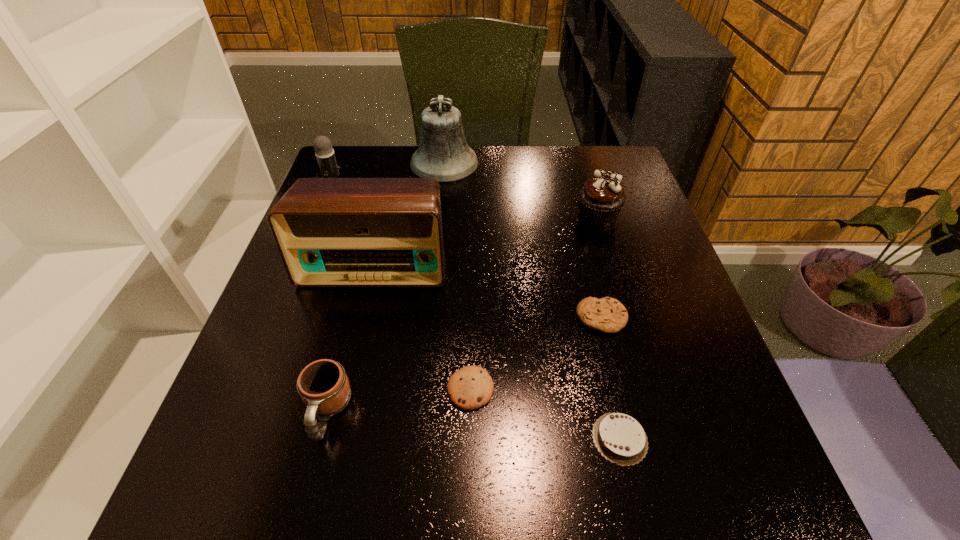
Identify the location of bell. (444, 154).

Find the location of a particular element. This screenshot has width=960, height=540. the fifth nearest object is located at coordinates (330, 232).

At what (x,y) coordinates should I click in order to perform the action: click on the seventh nearest object. Please return your answer as a coordinate pair (x, y). This screenshot has width=960, height=540. Looking at the image, I should click on (325, 155).

At what (x,y) coordinates should I click in order to perform the action: click on microphone. Please return your answer as a coordinate pair (x, y). This screenshot has height=540, width=960. Looking at the image, I should click on (325, 155).

Identify the location of cupcake. The height and width of the screenshot is (540, 960). (601, 198).

Where is `the third farthest object`? This screenshot has height=540, width=960. the third farthest object is located at coordinates [601, 198].

Locate an element on the screen. the fifth tallest object is located at coordinates (323, 385).

Find the location of `the fourth nearest object`. the fourth nearest object is located at coordinates (608, 315).

The image size is (960, 540). What are the coordinates of `the right cookie` in the screenshot? It's located at (608, 315).

The width and height of the screenshot is (960, 540). I want to click on the left cookie, so pyautogui.click(x=470, y=387).